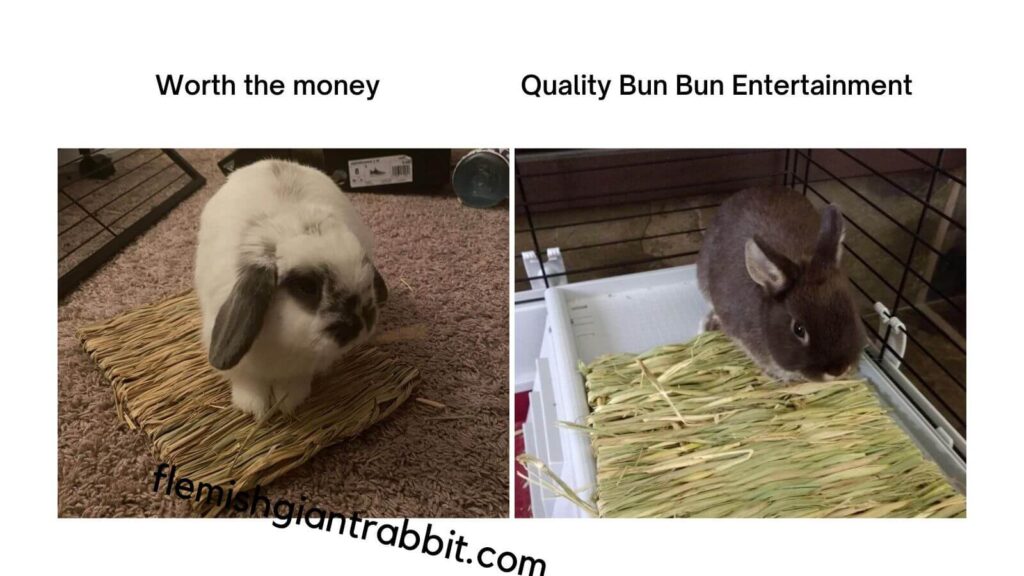
Locate an element on the screen. Image resolution: width=1024 pixels, height=576 pixels. carpet is located at coordinates (458, 473).